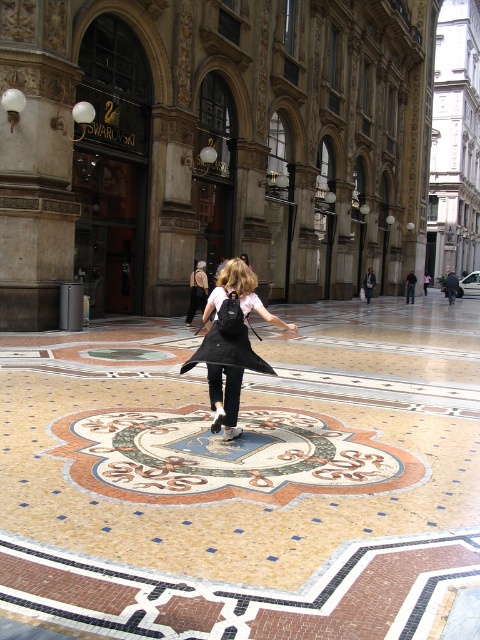
Between point (205, 356) and point (199, 349), which one is positioned behind?

Positioned behind is point (199, 349).

I want to click on black matte backpack at center, so 230,342.

What do you see at coordinates (230, 342) in the screenshot?
I see `black matte backpack at center` at bounding box center [230, 342].

Identify the location of black matte backpack at center. (230, 342).